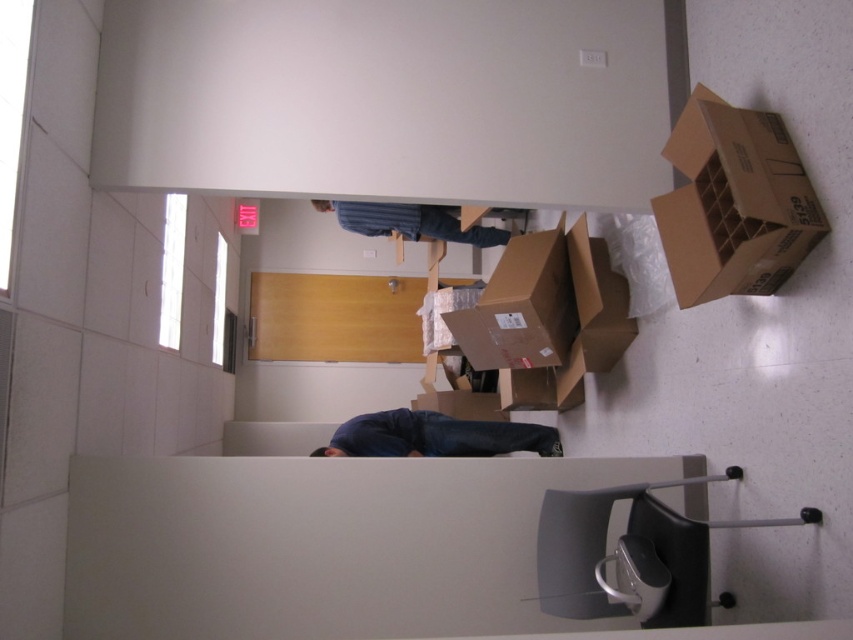
Question: Does brown cardboard box at center have a larger size compared to blue jeans at lower center?

Choices:
 (A) no
 (B) yes

Answer: (A)

Question: Which object appears farthest from the camera in this image?

Choices:
 (A) blue denim jeans at upper center
 (B) brown cardboard box at center
 (C) blue jeans at lower center

Answer: (A)

Question: Can you confirm if brown cardboard box at center is bigger than blue denim jeans at upper center?

Choices:
 (A) no
 (B) yes

Answer: (A)

Question: Which point is farther to the camera?

Choices:
 (A) (x=685, y=116)
 (B) (x=469, y=240)
 (C) (x=421, y=440)
 (D) (x=534, y=365)

Answer: (B)

Question: Which of the following is the farthest from the observer?

Choices:
 (A) (541, 273)
 (B) (421, 449)

Answer: (B)

Question: Can you confirm if brown cardboard box at upper right is positioned above blue denim jeans at upper center?

Choices:
 (A) no
 (B) yes

Answer: (A)